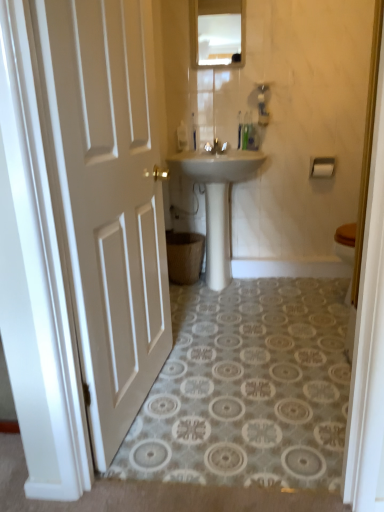
Where is `white matte toilet paper at right`? This screenshot has height=512, width=384. white matte toilet paper at right is located at coordinates (322, 169).

The width and height of the screenshot is (384, 512). What do you see at coordinates (109, 200) in the screenshot?
I see `white matte door at left` at bounding box center [109, 200].

What are the coordinates of `white glossy sink at center` in the screenshot? It's located at (217, 200).

Can you confirm if white matte door at left is smaller than white matte toilet paper at right?

Actually, white matte door at left might be larger than white matte toilet paper at right.

Consider the image. From the image's perspective, does white matte door at left appear higher than white matte toilet paper at right?

No, from the image's perspective, white matte door at left is not on top of white matte toilet paper at right.

Considering the positions of objects white matte door at left and white matte toilet paper at right in the image provided, who is more to the right, white matte door at left or white matte toilet paper at right?

From the viewer's perspective, white matte toilet paper at right appears more on the right side.

Locate an element on the screen. This screenshot has width=384, height=512. toilet paper directly beneath the white matte door at left (from a real-world perspective) is located at coordinates (322, 169).

Is glossy glass mirror at upper center outside of white matte toilet paper at right?

Yes.

Can you confirm if glossy glass mirror at upper center is smaller than white matte toilet paper at right?

Incorrect, glossy glass mirror at upper center is not smaller in size than white matte toilet paper at right.

Measure the distance from glossy glass mirror at upper center to white matte toilet paper at right.

38.31 inches.

Which is more distant, (106, 52) or (198, 52)?

Point (198, 52)

How many degrees apart are the facing directions of white matte door at left and glossy glass mirror at upper center?

They differ by 82 degrees in their facing directions.

From the image's perspective, relative to glossy glass mirror at upper center, is white matte door at left above or below?

white matte door at left is situated lower than glossy glass mirror at upper center in the image.

Are white matte door at left and glossy glass mirror at upper center making contact?

They are not placed beside each other.

Is white matte door at left looking in the opposite direction of matte white faucet at center?

No, white matte door at left is not facing the opposite direction of matte white faucet at center.

Which is more to the right, white matte door at left or matte white faucet at center?

From the viewer's perspective, matte white faucet at center appears more on the right side.

From a real-world perspective, is white matte door at left over matte white faucet at center?

No, from a real-world perspective, white matte door at left is not above matte white faucet at center.

Does white matte door at left come behind matte white faucet at center?

No, the depth of white matte door at left is less than that of matte white faucet at center.

Are white glossy sink at center and white matte toilet paper at right located far from each other?

No, white glossy sink at center is in close proximity to white matte toilet paper at right.

Is white glossy sink at center oriented towards white matte toilet paper at right?

No.

From the image's perspective, between white glossy sink at center and white matte toilet paper at right, which one is located above?

From the image's view, white matte toilet paper at right is above.

From a real-world perspective, is white glossy sink at center positioned over white matte toilet paper at right based on gravity?

No, from a real-world perspective, white glossy sink at center is not over white matte toilet paper at right

Is glossy glass mirror at upper center in front of or behind matte white faucet at center in the image?

Visually, glossy glass mirror at upper center is located in front of matte white faucet at center.

Are glossy glass mirror at upper center and matte white faucet at center located far from each other?

glossy glass mirror at upper center is actually quite close to matte white faucet at center.

From a real-world perspective, which object rests below the other?

matte white faucet at center, from a real-world perspective.

Between glossy glass mirror at upper center and matte white faucet at center, which one has smaller width?

With smaller width is glossy glass mirror at upper center.

Which is closer to the camera, (330, 170) or (56, 98)?

Point (330, 170) is farther from the camera than point (56, 98).

Can you confirm if white matte toilet paper at right is positioned to the left of white matte door at left?

In fact, white matte toilet paper at right is to the right of white matte door at left.

Can you tell me how much white matte toilet paper at right and white matte door at left differ in facing direction?

The angular difference between white matte toilet paper at right and white matte door at left is 83 degrees.

In the image, there is a white matte door at left. Where is `toilet paper below it (from a real-world perspective)`? The height and width of the screenshot is (512, 384). toilet paper below it (from a real-world perspective) is located at coordinates (322, 169).

Where is `toilet paper below the glossy glass mirror at upper center (from the image's perspective)`? The height and width of the screenshot is (512, 384). toilet paper below the glossy glass mirror at upper center (from the image's perspective) is located at coordinates (322, 169).

Based on the photo, based on their spatial positions, is white matte toilet paper at right or matte white faucet at center closer to white matte door at left?

Based on the image, matte white faucet at center appears to be nearer to white matte door at left.

From the image, which object appears to be nearer to white matte toilet paper at right, matte white faucet at center or white matte door at left?

Based on the image, matte white faucet at center appears to be nearer to white matte toilet paper at right.

From the picture: Looking at the image, which one is located closer to white glossy sink at center, matte white faucet at center or white matte toilet paper at right?

matte white faucet at center.

Considering their positions, is white matte door at left positioned further to white matte toilet paper at right than matte white faucet at center?

white matte door at left lies further to white matte toilet paper at right than the other object.

Based on their spatial positions, is white matte door at left or white matte toilet paper at right closer to matte white faucet at center?

white matte toilet paper at right is positioned closer to the anchor matte white faucet at center.

Based on their spatial positions, is white glossy sink at center or matte white faucet at center closer to white matte door at left?

Among the two, white glossy sink at center is located nearer to white matte door at left.

Looking at the image, which one is located further to white matte toilet paper at right, white glossy sink at center or white matte door at left?

white matte door at left is positioned further to the anchor white matte toilet paper at right.

Considering their positions, is matte white faucet at center positioned further to white matte door at left than white glossy sink at center?

Among the two, matte white faucet at center is located further to white matte door at left.

Find the location of a particular element. The image size is (384, 512). toilet paper between glossy glass mirror at upper center and white glossy sink at center in the up-down direction is located at coordinates tap(322, 169).

Locate an element on the screen. This screenshot has width=384, height=512. mirror between white matte door at left and white matte toilet paper at right from front to back is located at coordinates (217, 33).

You are a GUI agent. You are given a task and a screenshot of the screen. Output one action in this format:
    pyautogui.click(x=<x>, y=<y>)
    Task: Click on the sink located between white matte door at left and matte white faucet at center in the depth direction
    
    Given the screenshot: What is the action you would take?
    pyautogui.click(x=217, y=200)

I want to click on tap that lies between glossy glass mirror at upper center and white matte toilet paper at right from top to bottom, so click(x=216, y=147).